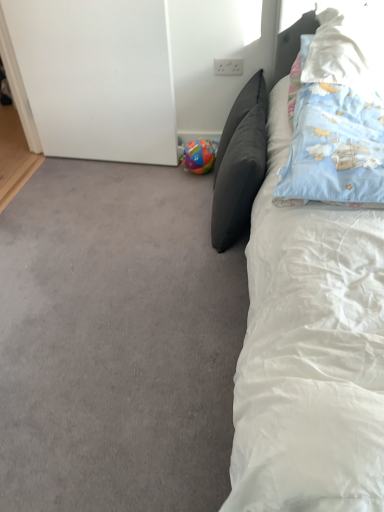
This screenshot has height=512, width=384. What do you see at coordinates (309, 353) in the screenshot?
I see `white soft bed at right` at bounding box center [309, 353].

Image resolution: width=384 pixels, height=512 pixels. What do you see at coordinates (348, 48) in the screenshot? I see `white soft pillow at upper right, the 1th pillow when ordered from right to left` at bounding box center [348, 48].

Measure the distance between gray carpet at lower left and camera.

gray carpet at lower left is 3.55 feet away from camera.

The height and width of the screenshot is (512, 384). Describe the element at coordinates (116, 341) in the screenshot. I see `gray carpet at lower left` at that location.

The image size is (384, 512). What do you see at coordinates (337, 115) in the screenshot?
I see `blue cotton pillow at upper right, acting as the second pillow starting from the left` at bounding box center [337, 115].

What do you see at coordinates (198, 156) in the screenshot?
I see `multicolored plastic ball at lower left` at bounding box center [198, 156].

In order to click on white soft bed at right in this screenshot , I will do `click(309, 353)`.

Considering the points (216, 223) and (205, 154), which point is in front, point (216, 223) or point (205, 154)?

The point (216, 223) is closer.

Which object is wider, dark gray cushion at center, which is counted as the first pillow, starting from the left, or multicolored plastic ball at lower left?

dark gray cushion at center, which is counted as the first pillow, starting from the left, is wider.

Measure the distance from dark gray cushion at center, which is counted as the first pillow, starting from the left, to multicolored plastic ball at lower left.

17.66 inches.

Can you confirm if dark gray cushion at center, positioned as the third pillow in right-to-left order, is shorter than multicolored plastic ball at lower left?

In fact, dark gray cushion at center, positioned as the third pillow in right-to-left order, may be taller than multicolored plastic ball at lower left.

Locate an element on the screen. Image resolution: width=384 pixels, height=512 pixels. toy on the left of white soft pillow at upper right, the 1th pillow when ordered from right to left is located at coordinates (198, 156).

Is white soft pillow at upper right, positioned as the 3th pillow in left-to-right order, looking in the opposite direction of multicolored plastic ball at lower left?

No, white soft pillow at upper right, positioned as the 3th pillow in left-to-right order,'s orientation is not away from multicolored plastic ball at lower left.

Is white soft pillow at upper right, positioned as the 3th pillow in left-to-right order, next to multicolored plastic ball at lower left and touching it?

No, white soft pillow at upper right, positioned as the 3th pillow in left-to-right order, is not with multicolored plastic ball at lower left.

Is gray carpet at lower left further to camera compared to dark gray cushion at center, which is counted as the first pillow, starting from the left?

No, gray carpet at lower left is closer to the camera.

Considering the relative sizes of gray carpet at lower left and dark gray cushion at center, which is counted as the first pillow, starting from the left, in the image provided, is gray carpet at lower left shorter than dark gray cushion at center, which is counted as the first pillow, starting from the left,?

Correct, gray carpet at lower left is not as tall as dark gray cushion at center, which is counted as the first pillow, starting from the left.

Find the location of a particular element. The width and height of the screenshot is (384, 512). the 1st pillow above the gray carpet at lower left (from the image's perspective) is located at coordinates (239, 163).

In terms of width, does gray carpet at lower left look wider or thinner when compared to dark gray cushion at center, positioned as the third pillow in right-to-left order?

gray carpet at lower left is wider than dark gray cushion at center, positioned as the third pillow in right-to-left order.

Measure the distance from white soft bed at right to dark gray cushion at center, positioned as the third pillow in right-to-left order.

25.06 inches.

Between white soft bed at right and dark gray cushion at center, positioned as the third pillow in right-to-left order, which one appears on the left side from the viewer's perspective?

From the viewer's perspective, dark gray cushion at center, positioned as the third pillow in right-to-left order, appears more on the left side.

Locate an element on the screen. This screenshot has height=512, width=384. pillow that is the 3rd object located behind the white soft bed at right is located at coordinates (239, 163).

Is white soft bed at right in front of or behind dark gray cushion at center, positioned as the third pillow in right-to-left order, in the image?

In the image, white soft bed at right appears in front of dark gray cushion at center, positioned as the third pillow in right-to-left order.

Can white soft bed at right be found inside white soft pillow at upper right, positioned as the 3th pillow in left-to-right order?

No, white soft bed at right is not a part of white soft pillow at upper right, positioned as the 3th pillow in left-to-right order.

From the white soft bed at right, count 2nd pillow to the right and point to it. Please provide its 2D coordinates.

[(348, 48)]

Is white soft pillow at upper right, the 1th pillow when ordered from right to left, taller or shorter than white soft bed at right?

Result: Considering their sizes, white soft pillow at upper right, the 1th pillow when ordered from right to left, has less height than white soft bed at right.

Who is smaller, multicolored plastic ball at lower left or white soft bed at right?

Smaller between the two is multicolored plastic ball at lower left.

From the image's perspective, between multicolored plastic ball at lower left and white soft bed at right, who is located below?

white soft bed at right is shown below in the image.

Is multicolored plastic ball at lower left located outside white soft bed at right?

multicolored plastic ball at lower left lies outside white soft bed at right's area.

Is white soft bed at right at the back of multicolored plastic ball at lower left?

No, white soft bed at right is not at the back of multicolored plastic ball at lower left.

In the scene shown: What's the angular difference between blue cotton pillow at upper right, which is the 2th pillow from right to left, and white soft pillow at upper right, positioned as the 3th pillow in left-to-right order,'s facing directions?

They differ by 1.15 degrees in their facing directions.

Who is smaller, blue cotton pillow at upper right, acting as the second pillow starting from the left, or white soft pillow at upper right, positioned as the 3th pillow in left-to-right order?

white soft pillow at upper right, positioned as the 3th pillow in left-to-right order, is smaller.

In the scene shown: Between blue cotton pillow at upper right, acting as the second pillow starting from the left, and white soft pillow at upper right, positioned as the 3th pillow in left-to-right order, which one is positioned in front?

blue cotton pillow at upper right, acting as the second pillow starting from the left, is closer to the camera.

From the image's perspective, which pillow is the 2nd one below the multicolored plastic ball at lower left? Please provide its 2D coordinates.

[(239, 163)]

Where is `the 2nd pillow in front when counting from the multicolored plastic ball at lower left`? The width and height of the screenshot is (384, 512). the 2nd pillow in front when counting from the multicolored plastic ball at lower left is located at coordinates (348, 48).

Which object lies further to the anchor point dark gray cushion at center, which is counted as the first pillow, starting from the left, multicolored plastic ball at lower left or white soft bed at right?

white soft bed at right is further to dark gray cushion at center, which is counted as the first pillow, starting from the left.

Estimate the real-world distances between objects in this image. Which object is further from gray carpet at lower left, white soft bed at right or blue cotton pillow at upper right, acting as the second pillow starting from the left?

blue cotton pillow at upper right, acting as the second pillow starting from the left.

When comparing their distances from gray carpet at lower left, does dark gray cushion at center, positioned as the third pillow in right-to-left order, or white soft pillow at upper right, positioned as the 3th pillow in left-to-right order, seem further?

Among the two, white soft pillow at upper right, positioned as the 3th pillow in left-to-right order, is located further to gray carpet at lower left.

Estimate the real-world distances between objects in this image. Which object is closer to white soft bed at right, gray carpet at lower left or multicolored plastic ball at lower left?

Among the two, gray carpet at lower left is located nearer to white soft bed at right.

From the picture: Estimate the real-world distances between objects in this image. Which object is closer to white soft pillow at upper right, the 1th pillow when ordered from right to left, gray carpet at lower left or dark gray cushion at center, which is counted as the first pillow, starting from the left?

dark gray cushion at center, which is counted as the first pillow, starting from the left, lies closer to white soft pillow at upper right, the 1th pillow when ordered from right to left, than the other object.

From the picture: Estimate the real-world distances between objects in this image. Which object is further from dark gray cushion at center, positioned as the third pillow in right-to-left order, blue cotton pillow at upper right, acting as the second pillow starting from the left, or multicolored plastic ball at lower left?

multicolored plastic ball at lower left lies further to dark gray cushion at center, positioned as the third pillow in right-to-left order, than the other object.

Looking at the image, which one is located further to white soft pillow at upper right, positioned as the 3th pillow in left-to-right order, gray carpet at lower left or blue cotton pillow at upper right, acting as the second pillow starting from the left?

Based on the image, gray carpet at lower left appears to be further to white soft pillow at upper right, positioned as the 3th pillow in left-to-right order.

Which object lies further to the anchor point gray carpet at lower left, dark gray cushion at center, positioned as the third pillow in right-to-left order, or white soft bed at right?

Based on the image, white soft bed at right appears to be further to gray carpet at lower left.

Where is `pillow positioned between white soft pillow at upper right, positioned as the 3th pillow in left-to-right order, and multicolored plastic ball at lower left from near to far`? This screenshot has width=384, height=512. pillow positioned between white soft pillow at upper right, positioned as the 3th pillow in left-to-right order, and multicolored plastic ball at lower left from near to far is located at coordinates (239, 163).

Where is `pillow between blue cotton pillow at upper right, acting as the second pillow starting from the left, and dark gray cushion at center, which is counted as the first pillow, starting from the left, along the z-axis`? The image size is (384, 512). pillow between blue cotton pillow at upper right, acting as the second pillow starting from the left, and dark gray cushion at center, which is counted as the first pillow, starting from the left, along the z-axis is located at coordinates (348, 48).

Where is `pillow between gray carpet at lower left and blue cotton pillow at upper right, which is the 2th pillow from right to left`? pillow between gray carpet at lower left and blue cotton pillow at upper right, which is the 2th pillow from right to left is located at coordinates (239, 163).

You are a GUI agent. You are given a task and a screenshot of the screen. Output one action in this format:
    pyautogui.click(x=<x>, y=<y>)
    Task: Click on the pillow positioned between white soft bed at right and white soft pillow at upper right, positioned as the 3th pillow in left-to-right order, from near to far
    This screenshot has width=384, height=512.
    Given the screenshot: What is the action you would take?
    pyautogui.click(x=337, y=115)